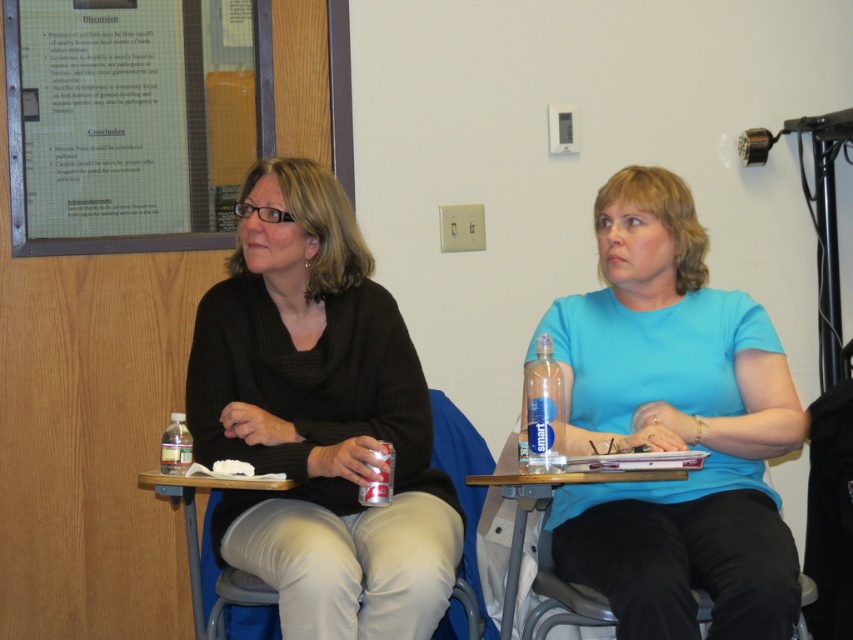
You are organizing a meeting in the conference room and need to place a large poster on the wall. Which object should you consider for its width to accommodate the poster, the matte glass bulletin board at upper left or the blue fabric chair at center?

The matte glass bulletin board at upper left has a greater width than the blue fabric chair at center, so it would be better to place the poster on the matte glass bulletin board at upper left.

You are a visitor in the conference room and need to hang a notice on the nearest bulletin board. Which object should you approach, the matte glass bulletin board at upper left or the blue fabric chair at center?

The matte glass bulletin board at upper left is the bulletin board you should approach to hang the notice since it is the only bulletin board mentioned in the scene. The blue fabric chair at center is a chair and not a bulletin board.